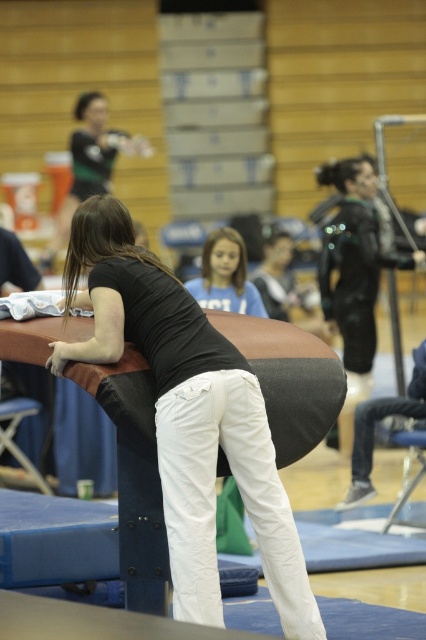
How distant is matte black shirt at center from black leather jacket at upper right?

They are 5.53 meters apart.

Does matte black shirt at center have a lesser height compared to black leather jacket at upper right?

Yes.

Is point (227, 352) closer to camera compared to point (348, 262)?

Yes, it is in front of point (348, 262).

The image size is (426, 640). Identify the location of matte black shirt at center. (187, 416).

Does matte black shirt at upper center appear under matte blue shirt at center?

Actually, matte black shirt at upper center is above matte blue shirt at center.

Is matte black shirt at upper center smaller than matte blue shirt at center?

Incorrect, matte black shirt at upper center is not smaller in size than matte blue shirt at center.

Is point (109, 147) in front of point (218, 259)?

No, it is behind (218, 259).

You are a GUI agent. You are given a task and a screenshot of the screen. Output one action in this format:
    pyautogui.click(x=<x>, y=<y>)
    Task: Click on the matte black shirt at upper center
    
    Given the screenshot: What is the action you would take?
    pyautogui.click(x=92, y=157)

Based on the photo, does matte black shirt at center have a lesser width compared to matte blue shirt at center?

Incorrect, matte black shirt at center's width is not less than matte blue shirt at center's.

Is matte black shirt at center taller than matte blue shirt at center?

Correct, matte black shirt at center is much taller as matte blue shirt at center.

Does point (296, 625) come behind point (230, 278)?

No, (296, 625) is in front of (230, 278).

The height and width of the screenshot is (640, 426). Find the location of `matte black shirt at center`. matte black shirt at center is located at coordinates (187, 416).